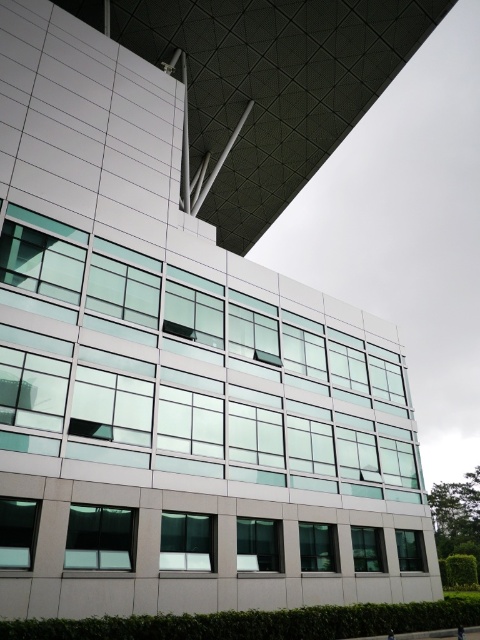
Question: Can you confirm if clear glass window at lower left is wider than transparent glass window at lower center?

Choices:
 (A) no
 (B) yes

Answer: (A)

Question: Among these points, which one is farthest from the camera?

Choices:
 (A) (268, 532)
 (B) (211, 532)
 (C) (46, 244)
 (D) (28, 548)

Answer: (A)

Question: Does clear glass window at lower left come in front of transparent glass window at lower right?

Choices:
 (A) yes
 (B) no

Answer: (A)

Question: Is clear glass window at lower right thinner than transparent glass window at lower right?

Choices:
 (A) yes
 (B) no

Answer: (B)

Question: Estimate the real-world distances between objects in this image. Which object is closer to the transparent glass window at lower right?

Choices:
 (A) transparent glass window at lower left
 (B) clear glass window at lower left
 (C) transparent glass window at center

Answer: (C)

Question: Which object appears farthest from the camera in this image?

Choices:
 (A) transparent glass window at lower center
 (B) transparent glass window at lower left
 (C) transparent glass window at center

Answer: (A)